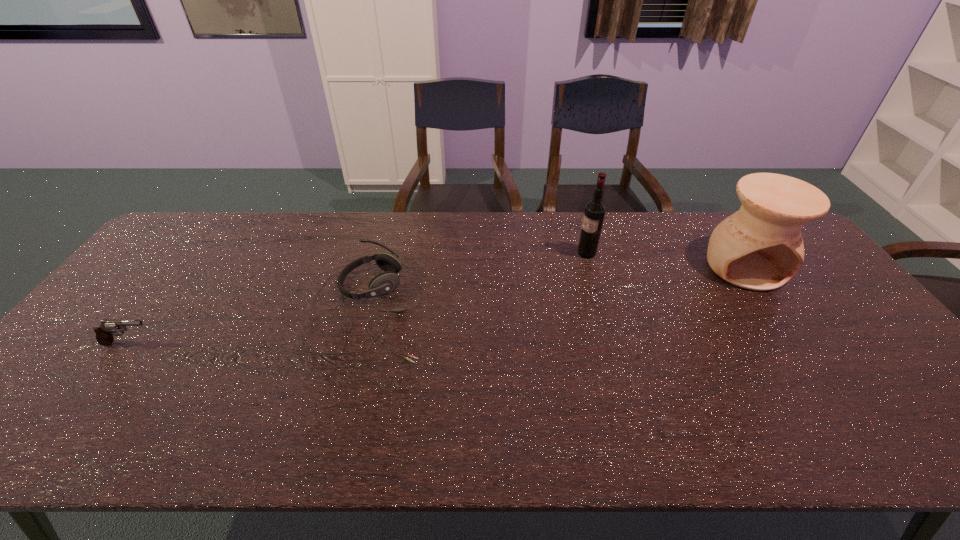
Where is `the third object from left to right`? The image size is (960, 540). the third object from left to right is located at coordinates pos(595,210).

Where is `pottery`? pottery is located at coordinates (760, 247).

Where is `headset`? This screenshot has height=540, width=960. headset is located at coordinates (386, 282).

At what (x,y) coordinates should I click in order to perform the action: click on pistol. Please return your answer as a coordinate pair (x, y). This screenshot has height=540, width=960. Looking at the image, I should click on (106, 328).

Where is `vacant position located on the front and back of the third object from left to right`? This screenshot has height=540, width=960. vacant position located on the front and back of the third object from left to right is located at coordinates (505, 253).

At what (x,y) coordinates should I click in order to perform the action: click on free space located on the front and back of the third object from left to right. Please return your answer as a coordinate pair (x, y). The image size is (960, 540). Looking at the image, I should click on (470, 253).

Locate an element on the screen. Image resolution: width=960 pixels, height=540 pixels. vacant space located 0.170m on the front and back of the third object from left to right is located at coordinates (523, 253).

In order to click on vacant space situated 0.290m at the open side of the pottery in this screenshot , I will do `click(820, 377)`.

This screenshot has height=540, width=960. I want to click on vacant space located 0.200m on the outer surface of the third object from right to left, so click(497, 307).

You are a GUI agent. You are given a task and a screenshot of the screen. Output one action in this format:
    pyautogui.click(x=<x>, y=<y>)
    Task: Click on the free space located 0.220m at the barrel of the leftmost object
    The height and width of the screenshot is (540, 960).
    Given the screenshot: What is the action you would take?
    pyautogui.click(x=241, y=343)